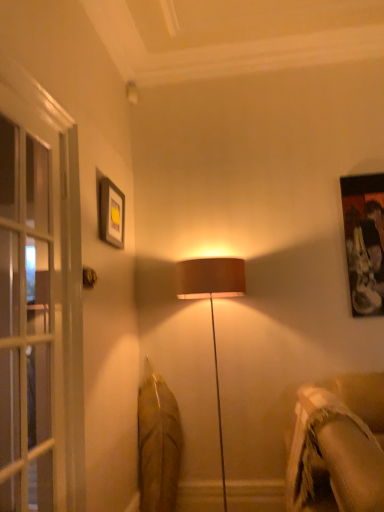
Question: From a real-world perspective, is metallic gold door handle at upper left positioned over matte black picture frame at upper left based on gravity?

Choices:
 (A) yes
 (B) no

Answer: (B)

Question: From the image's perspective, does metallic gold door handle at upper left appear higher than matte black picture frame at upper left?

Choices:
 (A) yes
 (B) no

Answer: (B)

Question: Would you say metallic gold door handle at upper left is outside matte black picture frame at upper left?

Choices:
 (A) no
 (B) yes

Answer: (B)

Question: Is metallic gold door handle at upper left positioned far away from matte black picture frame at upper left?

Choices:
 (A) no
 (B) yes

Answer: (A)

Question: From a real-world perspective, is metallic gold door handle at upper left physically below matte black picture frame at upper left?

Choices:
 (A) no
 (B) yes

Answer: (B)

Question: In terms of height, does clear glass screen door at left look taller or shorter compared to beige textured fabric couch at lower right?

Choices:
 (A) short
 (B) tall

Answer: (B)

Question: In terms of width, does clear glass screen door at left look wider or thinner when compared to beige textured fabric couch at lower right?

Choices:
 (A) wide
 (B) thin

Answer: (B)

Question: Does point (26, 399) appear closer or farther from the camera than point (344, 467)?

Choices:
 (A) farther
 (B) closer

Answer: (A)

Question: Visually, is clear glass screen door at left positioned to the left or to the right of beige textured fabric couch at lower right?

Choices:
 (A) left
 (B) right

Answer: (A)

Question: Considering the positions of point (82, 267) and point (357, 400), is point (82, 267) closer or farther from the camera than point (357, 400)?

Choices:
 (A) farther
 (B) closer

Answer: (B)

Question: Is metallic gold door handle at upper left to the left or to the right of beige textured fabric couch at lower right in the image?

Choices:
 (A) right
 (B) left

Answer: (B)

Question: Is metallic gold door handle at upper left taller or shorter than beige textured fabric couch at lower right?

Choices:
 (A) tall
 (B) short

Answer: (B)

Question: Looking at their shapes, would you say metallic gold door handle at upper left is wider or thinner than beige textured fabric couch at lower right?

Choices:
 (A) thin
 (B) wide

Answer: (A)

Question: From a real-world perspective, is beige textured fabric couch at lower right positioned above or below metallic gold door handle at upper left?

Choices:
 (A) above
 (B) below

Answer: (B)

Question: Is beige textured fabric couch at lower right taller or shorter than metallic gold door handle at upper left?

Choices:
 (A) short
 (B) tall

Answer: (B)